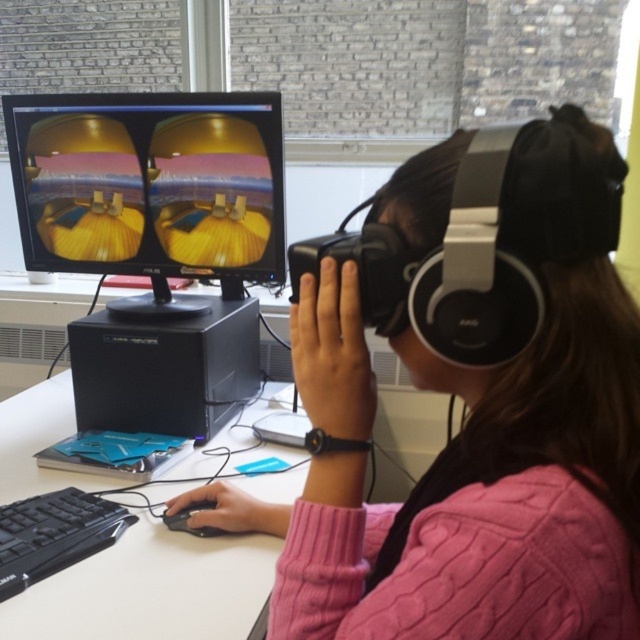
You are a VR developer testing the camera position in a virtual environment. The camera is placed at point (348, 508). You need to adjust the camera to be exactly 24 inches away from the user. Is the current position correct?

The point (348, 508) is 24.36 inches away from the camera, which is slightly more than 24 inches. Therefore, the current position is not exactly correct and needs adjustment.